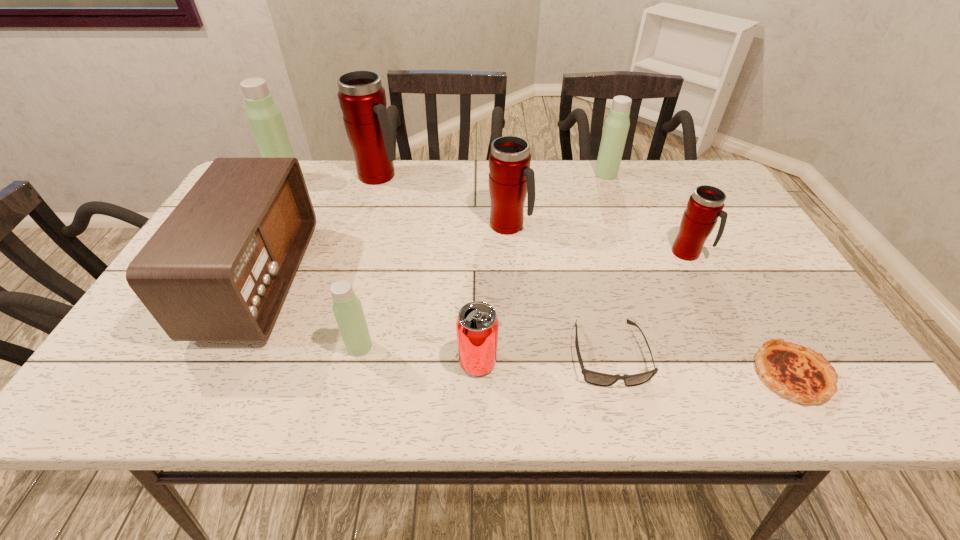
Where is `thermos bottle present at the left edge`? The image size is (960, 540). thermos bottle present at the left edge is located at coordinates (265, 119).

The image size is (960, 540). What are the coordinates of `radio receiver at the left edge` in the screenshot? It's located at (219, 268).

You are a GUI agent. You are given a task and a screenshot of the screen. Output one action in this format:
    pyautogui.click(x=<x>, y=<y>)
    Task: Click on the thermos bottle located at the right edge
    Image resolution: width=960 pixels, height=540 pixels.
    Given the screenshot: What is the action you would take?
    pyautogui.click(x=704, y=207)

This screenshot has width=960, height=540. Find the location of `quiche present at the right edge`. quiche present at the right edge is located at coordinates (794, 371).

Where is `object situated at the far left corner`? This screenshot has height=540, width=960. object situated at the far left corner is located at coordinates (265, 119).

Find the location of a particular element. object positioned at the near right corner is located at coordinates (794, 371).

Where is `free space at the far edge of the desktop`? The height and width of the screenshot is (540, 960). free space at the far edge of the desktop is located at coordinates (550, 179).

At what (x,y) coordinates should I click in order to perform the action: click on vacant area at the near edge of the desktop. Please return your answer as a coordinate pair (x, y). This screenshot has width=960, height=540. Looking at the image, I should click on (415, 368).

You are a GUI agent. You are given a task and a screenshot of the screen. Output one action in this format:
    pyautogui.click(x=<x>, y=<y>)
    Task: Click on the vacant region at the left edge of the desktop
    The width and height of the screenshot is (960, 540).
    Given the screenshot: What is the action you would take?
    pyautogui.click(x=148, y=359)

The width and height of the screenshot is (960, 540). What are the coordinates of `vacant region at the right edge of the desktop` in the screenshot? It's located at 834,355.